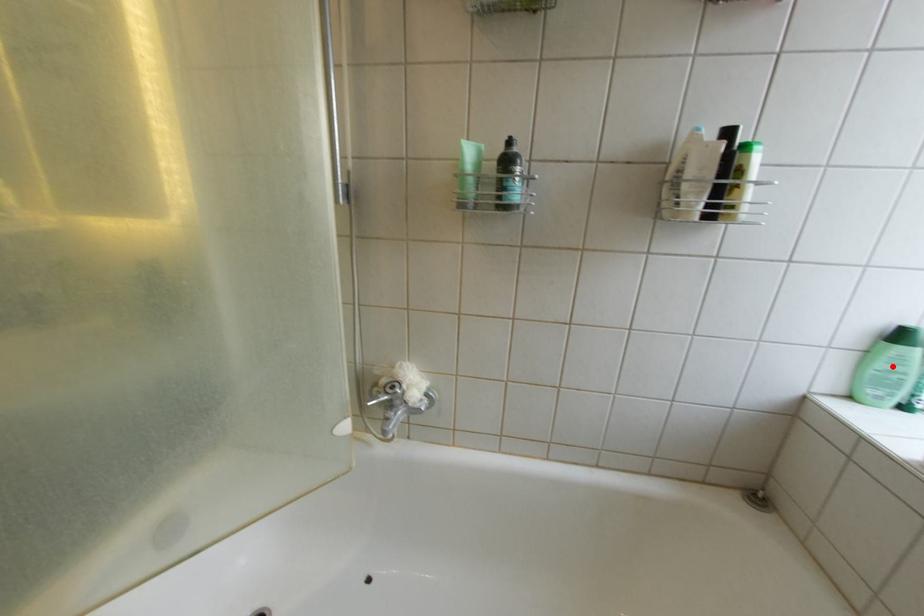
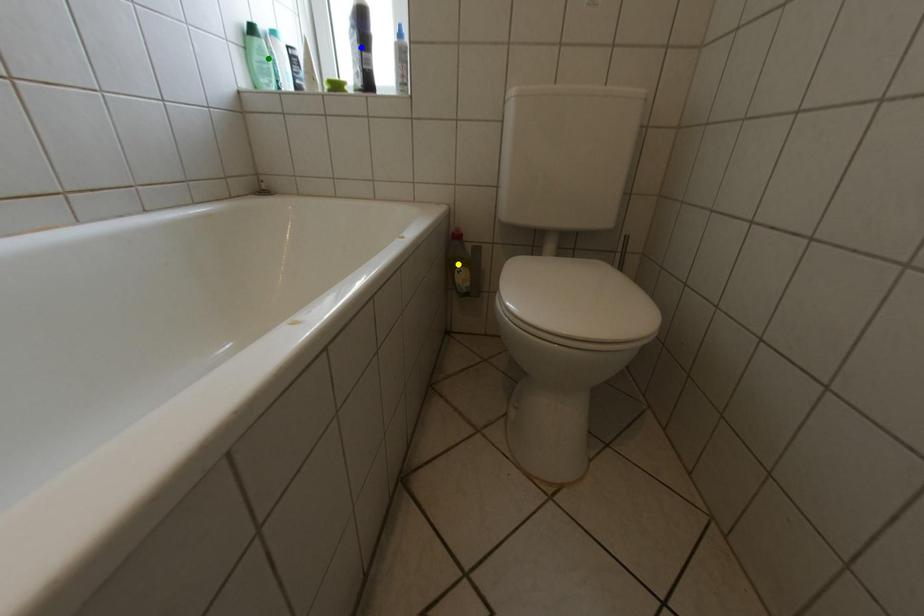
Question: I am providing you with two images of the same scene from different viewpoints. A red point is marked on the first image. You are given multiple points on the second image. Which mark in image 2 goes with the point in image 1?

Choices:
 (A) green point
 (B) yellow point
 (C) blue point

Answer: (A)